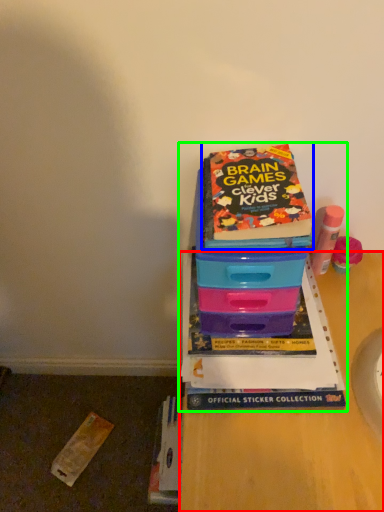
Question: Which object is the farthest from desk (highlighted by a red box)? Choose among these: book (highlighted by a blue box) or book (highlighted by a green box).

Choices:
 (A) book
 (B) book

Answer: (A)